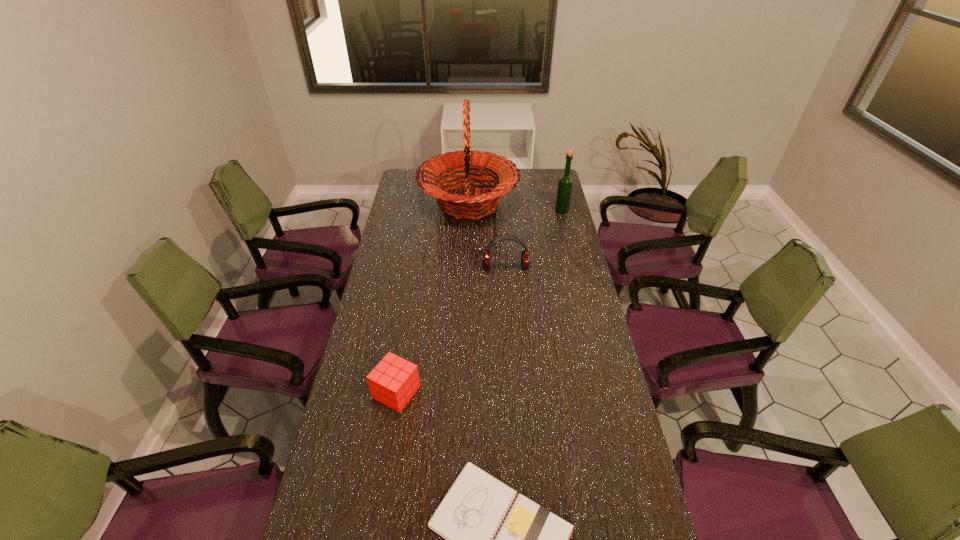
The width and height of the screenshot is (960, 540). I want to click on the tallest object, so click(480, 201).

Identify the location of the fourth shortest object. (565, 183).

This screenshot has width=960, height=540. Find the location of `the rightmost object`. the rightmost object is located at coordinates (565, 183).

The image size is (960, 540). Identify the location of earphone. tap(525, 255).

The height and width of the screenshot is (540, 960). Find the location of `the third nearest object`. the third nearest object is located at coordinates (525, 255).

Where is `the fourth tallest object`? the fourth tallest object is located at coordinates (393, 382).

At what (x,y) coordinates should I click in order to perform the action: click on cube. Please return your answer as a coordinate pair (x, y). Image resolution: width=960 pixels, height=540 pixels. Looking at the image, I should click on (393, 382).

Where is `free spot located on the front of the tallest object`? This screenshot has width=960, height=540. free spot located on the front of the tallest object is located at coordinates click(x=466, y=286).

This screenshot has height=540, width=960. Identify the location of vacant point located on the left of the fourth shortest object. (506, 211).

Where is `blank area located on the ear cups of the third tallest object`? blank area located on the ear cups of the third tallest object is located at coordinates 509,307.